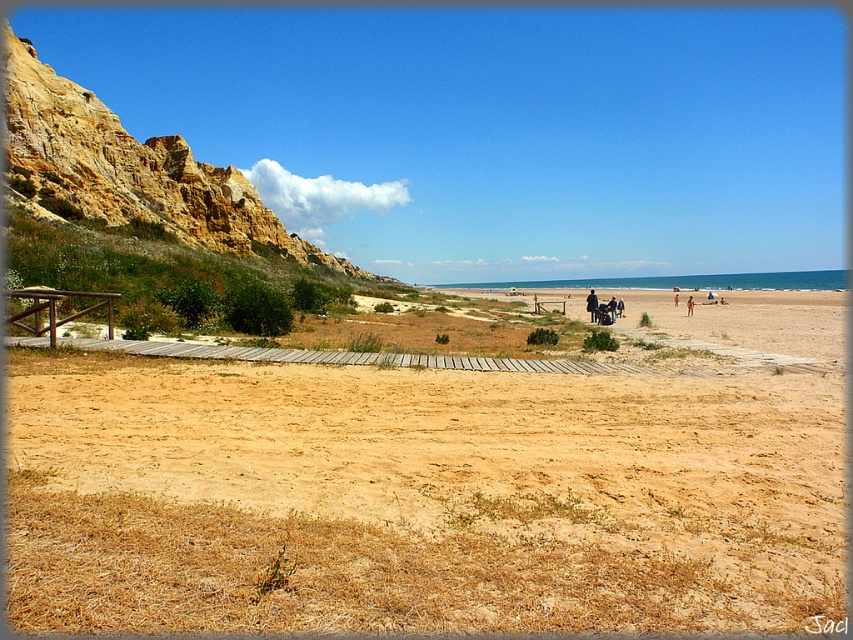
Based on the photo, who is taller, brown sandy dirt field at center or rustic stone cliff at left?

rustic stone cliff at left

Which is in front, point (386, 410) or point (193, 186)?

Positioned in front is point (386, 410).

Locate an element on the screen. The height and width of the screenshot is (640, 853). brown sandy dirt field at center is located at coordinates (419, 499).